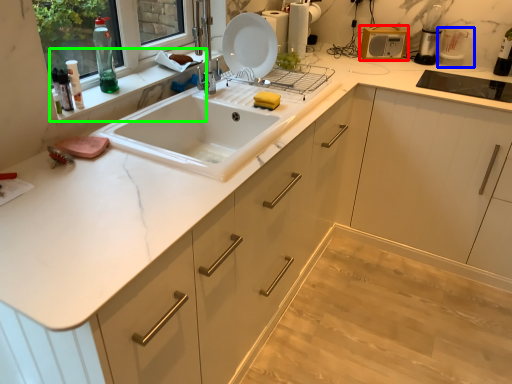
Question: Estimate the real-world distances between objects in this image. Which object is farther from appliance (highlighted by a red box), appliance (highlighted by a blue box) or window sill (highlighted by a green box)?

Choices:
 (A) appliance
 (B) window sill

Answer: (B)